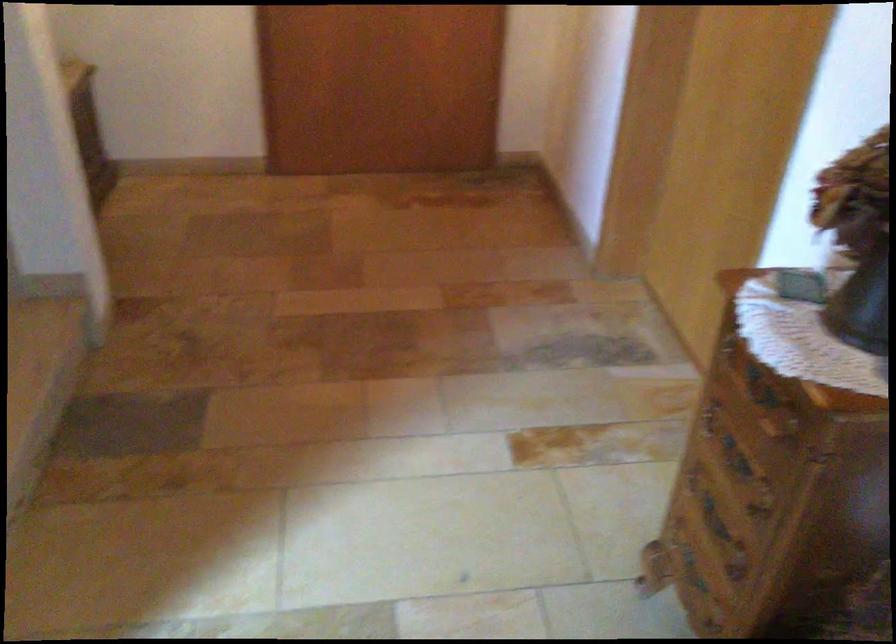
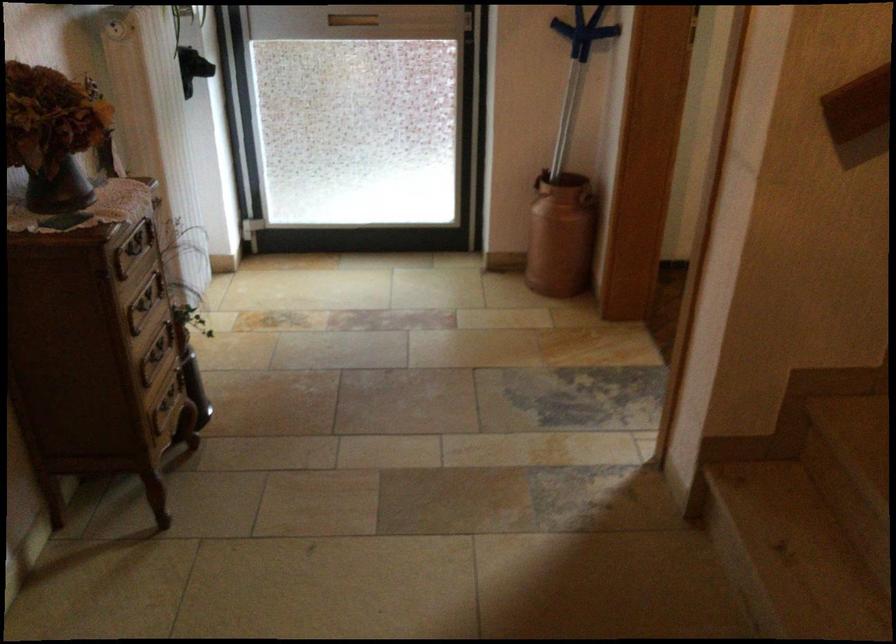
Where in the second image is the point corresponding to (752,459) from the first image?

(144, 303)